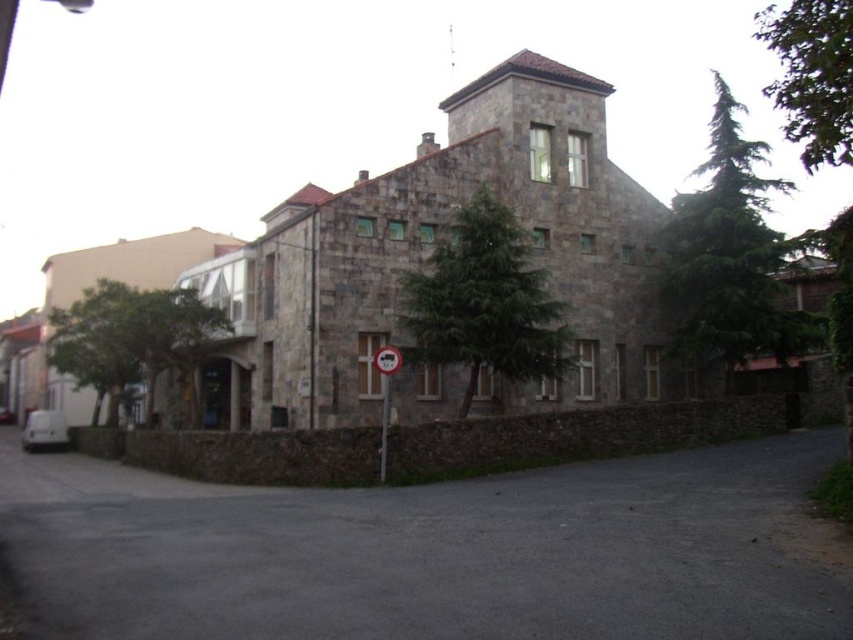
Can you confirm if green leafy tree at lower left is wider than white plastic sign at center?

Yes, green leafy tree at lower left is wider than white plastic sign at center.

Does green leafy tree at lower left have a larger size compared to white plastic sign at center?

Yes.

Where is `green leafy tree at lower left`? green leafy tree at lower left is located at coordinates (131, 337).

Find the location of a particular element. green leafy tree at lower left is located at coordinates (131, 337).

Is green leafy tree at upper right smaller than white plastic traffic sign at center?

Actually, green leafy tree at upper right might be larger than white plastic traffic sign at center.

The image size is (853, 640). In order to click on green leafy tree at upper right in this screenshot , I will do `click(811, 76)`.

This screenshot has height=640, width=853. What do you see at coordinates (811, 76) in the screenshot?
I see `green leafy tree at upper right` at bounding box center [811, 76].

I want to click on green leafy tree at upper right, so click(811, 76).

Who is lower down, green leafy tree at center or green leafy tree at lower left?

green leafy tree at center is lower down.

Which is more to the left, green leafy tree at center or green leafy tree at lower left?

From the viewer's perspective, green leafy tree at lower left appears more on the left side.

What do you see at coordinates (485, 301) in the screenshot? The image size is (853, 640). I see `green leafy tree at center` at bounding box center [485, 301].

Find the location of `green leafy tree at center`. green leafy tree at center is located at coordinates (485, 301).